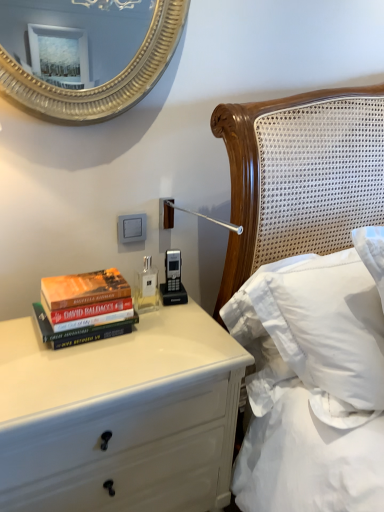
Find the location of a particular element. The height and width of the screenshot is (512, 384). empty space that is ontop of white glossy chest of drawers at lower left (from a real-world perspective) is located at coordinates (109, 345).